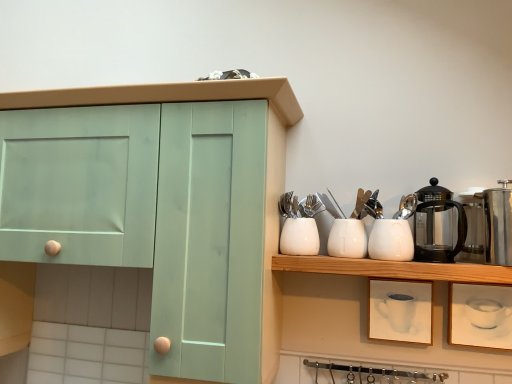
I want to click on metallic silver french press at right, which appears as the 1th tableware when viewed from the right, so click(406, 207).

Image resolution: width=512 pixels, height=384 pixels. What do you see at coordinates (312, 206) in the screenshot? I see `silver metallic forks at upper center` at bounding box center [312, 206].

Where is `black glass coffee pot at upper right`? This screenshot has width=512, height=384. black glass coffee pot at upper right is located at coordinates coord(437,225).

Identify the location of metallic silver french press at right, which appears as the 1th tableware when viewed from the right. (406, 207).

Where is `the 2nd appliance above when counting from the white glossy vase at center, the 1th tableware in the left-to-right sequence (from the image's perspective)`? the 2nd appliance above when counting from the white glossy vase at center, the 1th tableware in the left-to-right sequence (from the image's perspective) is located at coordinates (473, 226).

From the image's perspective, is clear glass carafe at upper right, placed as the second appliance when sorted from left to right, positioned above or below white glossy vase at center, which ranks as the third tableware in right-to-left order?

From the image's perspective, clear glass carafe at upper right, placed as the second appliance when sorted from left to right, appears above white glossy vase at center, which ranks as the third tableware in right-to-left order.

Could you measure the distance between clear glass carafe at upper right, placed as the second appliance when sorted from left to right, and white glossy vase at center, which ranks as the third tableware in right-to-left order?

44.82 centimeters.

Is clear glass carafe at upper right, placed as the second appliance when sorted from left to right, inside the boundaries of white glossy vase at center, which ranks as the third tableware in right-to-left order, or outside?

The correct answer is: outside.

Is silver metallic forks at upper center wider or thinner than black glass coffee pot at upper right?

silver metallic forks at upper center is thinner than black glass coffee pot at upper right.

Is black glass coffee pot at upper right completely or partially inside silver metallic forks at upper center?

No, black glass coffee pot at upper right is not surrounded by silver metallic forks at upper center.

Which object is further away from the camera taking this photo, silver metallic forks at upper center or black glass coffee pot at upper right?

silver metallic forks at upper center is further away from the camera.

Considering the relative positions of silver metallic forks at upper center and black glass coffee pot at upper right in the image provided, is silver metallic forks at upper center to the right of black glass coffee pot at upper right from the viewer's perspective?

No.

From a real-world perspective, relative to white glossy kettle at upper right, which is the 1th appliance in left-to-right order, is white glossy vase at center, which ranks as the third tableware in right-to-left order, vertically above or below?

white glossy vase at center, which ranks as the third tableware in right-to-left order, is situated lower than white glossy kettle at upper right, which is the 1th appliance in left-to-right order, in the real world.

Between point (287, 233) and point (403, 256), which one is positioned in front?

Positioned in front is point (403, 256).

Can you tell me how much white glossy vase at center, the 1th tableware in the left-to-right sequence, and white glossy kettle at upper right, which is the 1th appliance in left-to-right order, differ in facing direction?

0.000877 degrees separate the facing orientations of white glossy vase at center, the 1th tableware in the left-to-right sequence, and white glossy kettle at upper right, which is the 1th appliance in left-to-right order.

Is the position of white glossy vase at center, which ranks as the third tableware in right-to-left order, more distant than that of white glossy kettle at upper right, which is the 1th appliance in left-to-right order?

Yes, it is behind white glossy kettle at upper right, which is the 1th appliance in left-to-right order.

From the picture: Who is more distant, mint green wood cabinet at upper left or silver metallic forks at upper center?

silver metallic forks at upper center is behind.

Is mint green wood cabinet at upper left at the right side of silver metallic forks at upper center?

Incorrect, mint green wood cabinet at upper left is not on the right side of silver metallic forks at upper center.

How different are the orientations of mint green wood cabinet at upper left and silver metallic forks at upper center in degrees?

The angle between the facing direction of mint green wood cabinet at upper left and the facing direction of silver metallic forks at upper center is 1.98 degrees.

Is mint green wood cabinet at upper left far from silver metallic forks at upper center?

No, there isn't a large distance between mint green wood cabinet at upper left and silver metallic forks at upper center.

Is clear glass carafe at upper right, placed as the second appliance when sorted from left to right, facing towards white glossy kettle at upper right, which is the 1th appliance in left-to-right order?

No, clear glass carafe at upper right, placed as the second appliance when sorted from left to right, is not aimed at white glossy kettle at upper right, which is the 1th appliance in left-to-right order.

From a real-world perspective, does clear glass carafe at upper right, the 2th appliance positioned from the right, sit lower than white glossy kettle at upper right, the third appliance when ordered from right to left?

No, from a real-world perspective, clear glass carafe at upper right, the 2th appliance positioned from the right, is not beneath white glossy kettle at upper right, the third appliance when ordered from right to left.

Relative to white glossy kettle at upper right, the third appliance when ordered from right to left, is clear glass carafe at upper right, the 2th appliance positioned from the right, in front or behind?

Visually, clear glass carafe at upper right, the 2th appliance positioned from the right, is located in front of white glossy kettle at upper right, the third appliance when ordered from right to left.

Which of these two, clear glass carafe at upper right, the 2th appliance positioned from the right, or white glossy kettle at upper right, which is the 1th appliance in left-to-right order, stands shorter?

white glossy kettle at upper right, which is the 1th appliance in left-to-right order.

From a real-world perspective, relative to silver metallic forks at upper center, is black glass coffee pot at upper right vertically above or below?

From a real-world perspective, black glass coffee pot at upper right is physically below silver metallic forks at upper center.

In order to click on coffeepot that is below the silver metallic forks at upper center (from the image's perspective) in this screenshot , I will do `click(437, 225)`.

Looking at the image, does black glass coffee pot at upper right seem bigger or smaller compared to silver metallic forks at upper center?

Clearly, black glass coffee pot at upper right is larger in size than silver metallic forks at upper center.

Is black glass coffee pot at upper right positioned with its back to silver metallic forks at upper center?

black glass coffee pot at upper right is not turned away from silver metallic forks at upper center.

Is polished stainless steel coffee pot at right, arranged as the first appliance when viewed from the right, positioned far away from metallic silver french press at right, which appears as the 1th tableware when viewed from the right?

Actually, polished stainless steel coffee pot at right, arranged as the first appliance when viewed from the right, and metallic silver french press at right, which appears as the 1th tableware when viewed from the right, are a little close together.

Who is shorter, polished stainless steel coffee pot at right, arranged as the first appliance when viewed from the right, or metallic silver french press at right, which appears as the 1th tableware when viewed from the right?

Standing shorter between the two is metallic silver french press at right, which appears as the 1th tableware when viewed from the right.

Could metallic silver french press at right, which is the third tableware in left-to-right order, be considered to be inside polished stainless steel coffee pot at right, which ranks as the third appliance in left-to-right order?

Definitely not — metallic silver french press at right, which is the third tableware in left-to-right order, is not inside polished stainless steel coffee pot at right, which ranks as the third appliance in left-to-right order.

How distant is polished stainless steel coffee pot at right, arranged as the first appliance when viewed from the right, from metallic silver french press at right, which appears as the 1th tableware when viewed from the right?

polished stainless steel coffee pot at right, arranged as the first appliance when viewed from the right, and metallic silver french press at right, which appears as the 1th tableware when viewed from the right, are 20.56 centimeters apart.

Locate an element on the screen. This screenshot has height=384, width=512. the 3rd tableware behind the clear glass carafe at upper right, placed as the second appliance when sorted from left to right, counting from the anchor's position is located at coordinates (298, 237).

Image resolution: width=512 pixels, height=384 pixels. In order to click on silverware lying on the left of black glass coffee pot at upper right in this screenshot , I will do `click(312, 206)`.

When comparing their distances from mint green wood cabinet at upper left, does white glossy container at center, the 2th tableware in the left-to-right sequence, or white glossy vase at center, the 1th tableware in the left-to-right sequence, seem closer?

Among the two, white glossy vase at center, the 1th tableware in the left-to-right sequence, is located nearer to mint green wood cabinet at upper left.

From the image, which object appears to be farther from metallic silver french press at right, which is the third tableware in left-to-right order, white glossy vase at center, which ranks as the third tableware in right-to-left order, or silver metallic forks at upper center?

Based on the image, white glossy vase at center, which ranks as the third tableware in right-to-left order, appears to be further to metallic silver french press at right, which is the third tableware in left-to-right order.

Which object lies nearer to the anchor point polished stainless steel coffee pot at right, which ranks as the third appliance in left-to-right order, white glossy kettle at upper right, the third appliance when ordered from right to left, or white glossy vase at center, the 1th tableware in the left-to-right sequence?

white glossy kettle at upper right, the third appliance when ordered from right to left, is positioned closer to the anchor polished stainless steel coffee pot at right, which ranks as the third appliance in left-to-right order.

Looking at the image, which one is located closer to black glass coffee pot at upper right, clear glass carafe at upper right, placed as the second appliance when sorted from left to right, or white glossy container at center, marked as the 2th tableware in a right-to-left arrangement?

clear glass carafe at upper right, placed as the second appliance when sorted from left to right, is closer to black glass coffee pot at upper right.

When comparing their distances from white glossy container at center, marked as the 2th tableware in a right-to-left arrangement, does clear glass carafe at upper right, placed as the second appliance when sorted from left to right, or metallic silver french press at right, which is the third tableware in left-to-right order, seem further?

The object further to white glossy container at center, marked as the 2th tableware in a right-to-left arrangement, is clear glass carafe at upper right, placed as the second appliance when sorted from left to right.

From the image, which object appears to be nearer to black glass coffee pot at upper right, polished stainless steel coffee pot at right, arranged as the first appliance when viewed from the right, or metallic silver french press at right, which is the third tableware in left-to-right order?

metallic silver french press at right, which is the third tableware in left-to-right order, is positioned closer to the anchor black glass coffee pot at upper right.

From the image, which object appears to be nearer to metallic silver french press at right, which appears as the 1th tableware when viewed from the right, white glossy kettle at upper right, which is the 1th appliance in left-to-right order, or black glass coffee pot at upper right?

Among the two, white glossy kettle at upper right, which is the 1th appliance in left-to-right order, is located nearer to metallic silver french press at right, which appears as the 1th tableware when viewed from the right.

When comparing their distances from polished stainless steel coffee pot at right, arranged as the first appliance when viewed from the right, does white glossy kettle at upper right, which is the 1th appliance in left-to-right order, or black glass coffee pot at upper right seem closer?

Among the two, black glass coffee pot at upper right is located nearer to polished stainless steel coffee pot at right, arranged as the first appliance when viewed from the right.

Find the location of `coffeepot situated between metallic silver french press at right, which is the third tableware in left-to-right order, and polished stainless steel coffee pot at right, arranged as the first appliance when viewed from the right, from left to right`. coffeepot situated between metallic silver french press at right, which is the third tableware in left-to-right order, and polished stainless steel coffee pot at right, arranged as the first appliance when viewed from the right, from left to right is located at coordinates (437, 225).

Locate an element on the screen. Image resolution: width=512 pixels, height=384 pixels. appliance between mint green wood cabinet at upper left and black glass coffee pot at upper right from left to right is located at coordinates (391, 240).

This screenshot has height=384, width=512. In order to click on tableware situated between white glossy kettle at upper right, which is the 1th appliance in left-to-right order, and polished stainless steel coffee pot at right, which ranks as the third appliance in left-to-right order, from left to right in this screenshot , I will do `click(406, 207)`.

I want to click on coffeepot between white glossy container at center, marked as the 2th tableware in a right-to-left arrangement, and polished stainless steel coffee pot at right, which ranks as the third appliance in left-to-right order, in the horizontal direction, so click(437, 225).